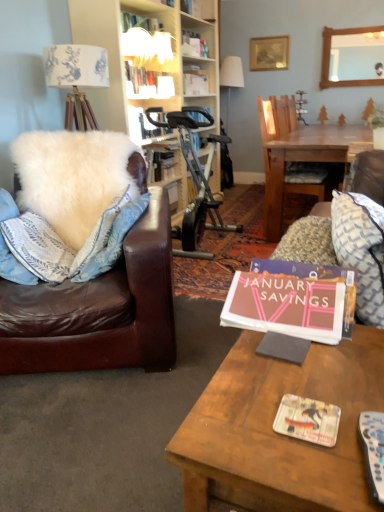
Question: Which direction should I rotate to look at matte white book at upper center, arranged as the first book when viewed from the top, — up or down?

Choices:
 (A) up
 (B) down

Answer: (A)

Question: Can you confirm if white fluffy pillow at left, placed as the second pillow when sorted from right to left, is shorter than patterned fabric pillow at right, which ranks as the 1th pillow in front-to-back order?

Choices:
 (A) yes
 (B) no

Answer: (B)

Question: From the image's perspective, would you say white fluffy pillow at left, the first pillow from the back, is positioned over patterned fabric pillow at right, which ranks as the 1th pillow in front-to-back order?

Choices:
 (A) yes
 (B) no

Answer: (A)

Question: Considering the relative sizes of white fluffy pillow at left, placed as the second pillow when sorted from right to left, and patterned fabric pillow at right, which ranks as the 1th pillow in front-to-back order, in the image provided, is white fluffy pillow at left, placed as the second pillow when sorted from right to left, thinner than patterned fabric pillow at right, which ranks as the 1th pillow in front-to-back order,?

Choices:
 (A) yes
 (B) no

Answer: (B)

Question: Does white fluffy pillow at left, placed as the second pillow when sorted from right to left, turn towards patterned fabric pillow at right, the first pillow when ordered from right to left?

Choices:
 (A) yes
 (B) no

Answer: (B)

Question: Are white fluffy pillow at left, which is the second pillow from front to back, and patterned fabric pillow at right, which appears as the 2th pillow when viewed from the back, far apart?

Choices:
 (A) no
 (B) yes

Answer: (B)

Question: Is white fluffy pillow at left, which is the second pillow from front to back, smaller than patterned fabric pillow at right, the 2th pillow in the left-to-right sequence?

Choices:
 (A) yes
 (B) no

Answer: (B)

Question: Does wooden picture frame at upper center have a smaller size compared to white plastic remote control at lower right?

Choices:
 (A) yes
 (B) no

Answer: (B)

Question: Considering the relative sizes of wooden picture frame at upper center and white plastic remote control at lower right in the image provided, is wooden picture frame at upper center wider than white plastic remote control at lower right?

Choices:
 (A) yes
 (B) no

Answer: (B)

Question: Is wooden picture frame at upper center thinner than white plastic remote control at lower right?

Choices:
 (A) no
 (B) yes

Answer: (B)

Question: Considering the relative positions of wooden picture frame at upper center and white plastic remote control at lower right in the image provided, is wooden picture frame at upper center behind white plastic remote control at lower right?

Choices:
 (A) yes
 (B) no

Answer: (A)

Question: Is wooden picture frame at upper center bigger than white plastic remote control at lower right?

Choices:
 (A) yes
 (B) no

Answer: (A)

Question: Does wooden picture frame at upper center contain white plastic remote control at lower right?

Choices:
 (A) no
 (B) yes

Answer: (A)

Question: Is white plastic remote control at lower right not near matte white book at upper center, the second book when ordered from bottom to top?

Choices:
 (A) no
 (B) yes

Answer: (B)